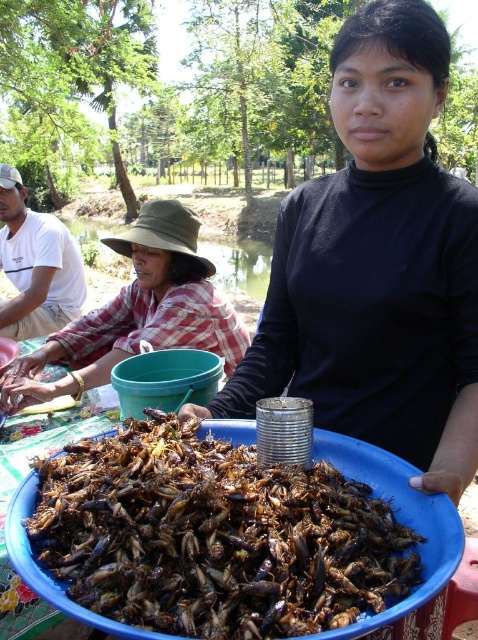
In the scene shown: Does black matte bowl at center have a larger size compared to plaid fabric shirt at left?

Correct, black matte bowl at center is larger in size than plaid fabric shirt at left.

Between black matte bowl at center and plaid fabric shirt at left, which one appears on the right side from the viewer's perspective?

black matte bowl at center is more to the right.

I want to click on black matte bowl at center, so click(x=378, y=266).

The image size is (478, 640). In order to click on black matte bowl at center in this screenshot , I will do `click(378, 266)`.

Can you confirm if black matte bowl at center is thinner than white cotton shirt at left?

No, black matte bowl at center is not thinner than white cotton shirt at left.

Can you confirm if black matte bowl at center is positioned below white cotton shirt at left?

Yes, black matte bowl at center is below white cotton shirt at left.

Locate an element on the screen. The height and width of the screenshot is (640, 478). black matte bowl at center is located at coordinates (378, 266).

Between brown matte insects at center and white cotton shirt at left, which one appears on the right side from the viewer's perspective?

brown matte insects at center

Does brown matte insects at center appear on the right side of white cotton shirt at left?

Indeed, brown matte insects at center is positioned on the right side of white cotton shirt at left.

Between point (368, 568) and point (10, 182), which one is positioned in front?

Point (368, 568)

This screenshot has width=478, height=640. In order to click on brown matte insects at center in this screenshot , I will do `click(215, 536)`.